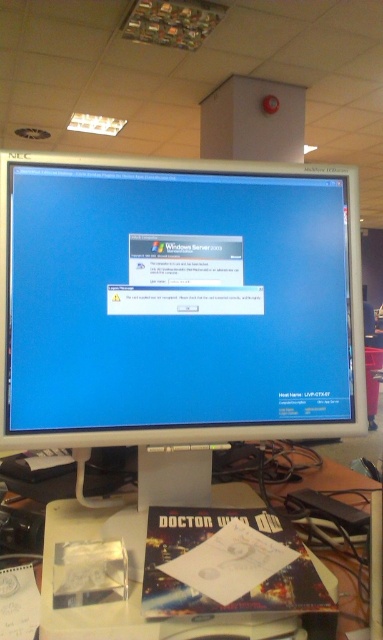
You are a technician troubleshooting a login issue on the white glossy monitor at center. The system displays an error about an unrecognized card. Where exactly is the monitor positioned relative to the desk?

The white glossy monitor at center is located at point [178,301], which means it is positioned centrally on the desk.

You are a technician standing in front of the white glossy monitor at center. You need to plug in a USB cable that is 24 inches long. Can you reach the USB port on the monitor without moving your body?

The distance between you and the white glossy monitor at center is 26.89 inches, which is longer than the 24 inch USB cable. Therefore, you cannot reach the USB port on the white glossy monitor at center without moving your body.

You are a technician trying to access the server. You need to move from the white plastic computer desk at center to the white glossy monitor at center to adjust the settings. Is the distance between them sufficient for you to comfortably walk without needing to move any items on the desk?

The distance between the white glossy monitor at center and the white plastic computer desk at center is 10.22 feet, which is more than enough space for a technician to comfortably walk between them without needing to move any items on the desk.